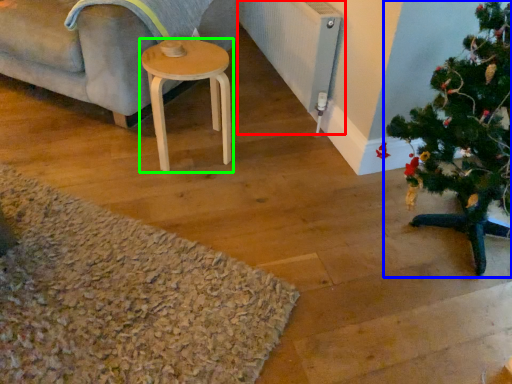
Question: Estimate the real-world distances between objects in this image. Which object is farther from radiator (highlighted by a red box), christmas tree (highlighted by a blue box) or stool (highlighted by a green box)?

Choices:
 (A) christmas tree
 (B) stool

Answer: (A)